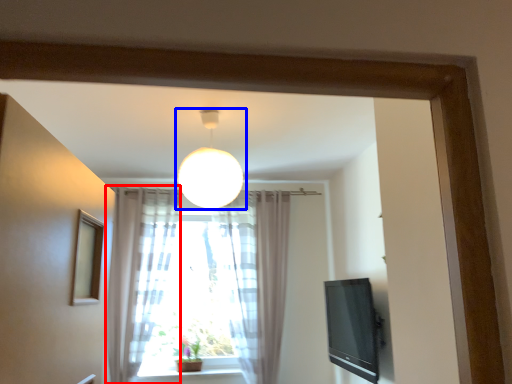
Question: Which object appears closest to the camera in this image, curtain (highlighted by a red box) or lamp (highlighted by a blue box)?

Choices:
 (A) curtain
 (B) lamp

Answer: (B)